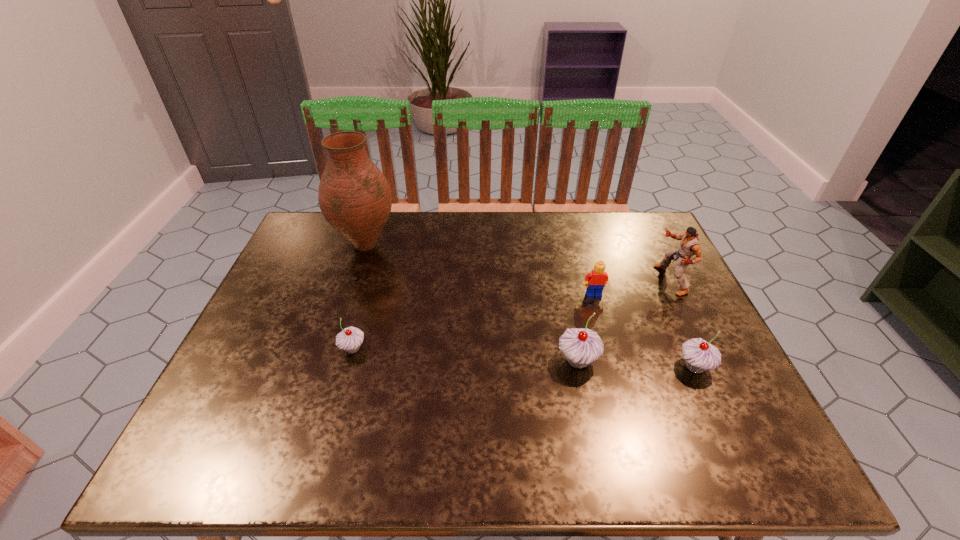
To achieve even spacing by inserting another cupcake among them, please point to a vacant spot for this new cupcake. Please provide its 2D coordinates. Your answer should be formatted as a tuple, i.e. [(x, y)], where the tuple contains the x and y coordinates of a point satisfying the conditions above.

[(464, 354)]